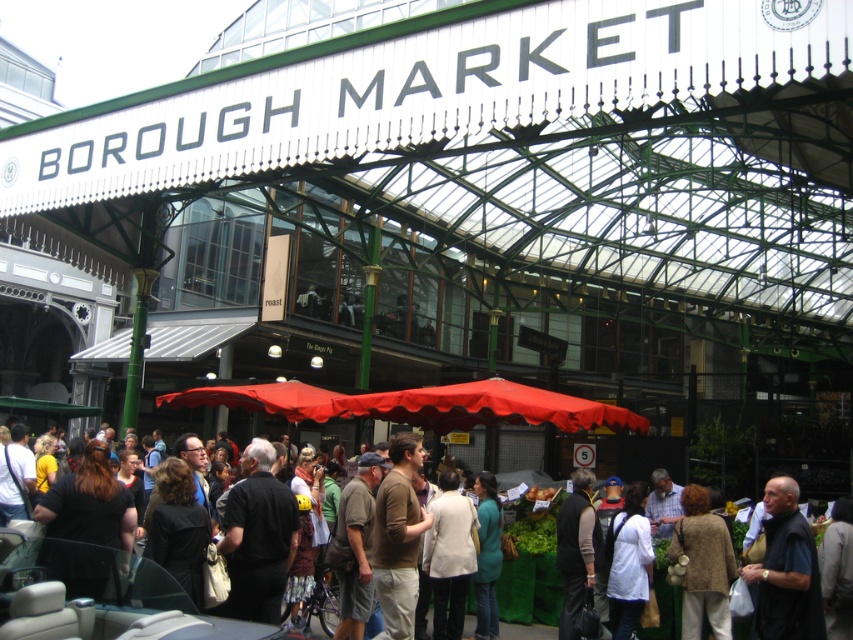
Question: Which point is farther to the camera?

Choices:
 (A) dark gray fabric jacket at lower right
 (B) white cotton shirt at center
 (C) black matte shirt at center

Answer: (C)

Question: From the image, what is the correct spatial relationship of white cotton shirt at center in relation to brown cotton shirt at center?

Choices:
 (A) right
 (B) left

Answer: (B)

Question: Can you confirm if dark gray fabric jacket at lower right is positioned below brown textured coat at lower right?

Choices:
 (A) yes
 (B) no

Answer: (B)

Question: Estimate the real-world distances between objects in this image. Which object is closer to the white cotton shirt at center?

Choices:
 (A) dark gray fabric jacket at lower right
 (B) black matte shirt at center
 (C) brown textured coat at lower right
 (D) brown cotton shirt at center

Answer: (B)

Question: Which of the following is the farthest from the observer?

Choices:
 (A) brown textured coat at lower right
 (B) white cotton shirt at center
 (C) black matte shirt at center
 (D) brown cotton shirt at center

Answer: (D)

Question: Considering the relative positions of dark gray fabric jacket at lower right and brown cotton shirt at center in the image provided, where is dark gray fabric jacket at lower right located with respect to brown cotton shirt at center?

Choices:
 (A) left
 (B) right

Answer: (B)